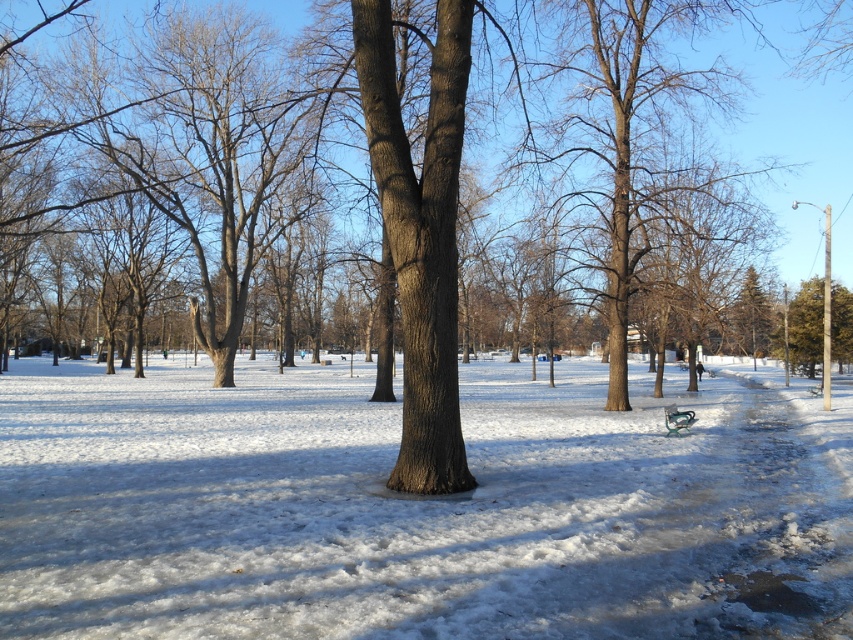
Question: Which object is the closest to the white fluffy snow at center?

Choices:
 (A) green plastic bench at lower right
 (B) brown bark tree at center
 (C) green textured tree at right

Answer: (B)

Question: Which object is positioned farthest from the green textured tree at right?

Choices:
 (A) brown bark tree at center
 (B) green plastic bench at lower right

Answer: (B)

Question: Considering the relative positions of green textured tree at right and green plastic bench at lower right in the image provided, where is green textured tree at right located with respect to green plastic bench at lower right?

Choices:
 (A) above
 (B) below

Answer: (A)

Question: In this image, where is green textured evergreen tree at right located relative to green plastic bench at lower right?

Choices:
 (A) above
 (B) below

Answer: (A)

Question: Which point is farther to the camera?

Choices:
 (A) (688, 412)
 (B) (840, 285)

Answer: (B)

Question: Is brown bark tree at center bigger than green textured tree at right?

Choices:
 (A) yes
 (B) no

Answer: (A)